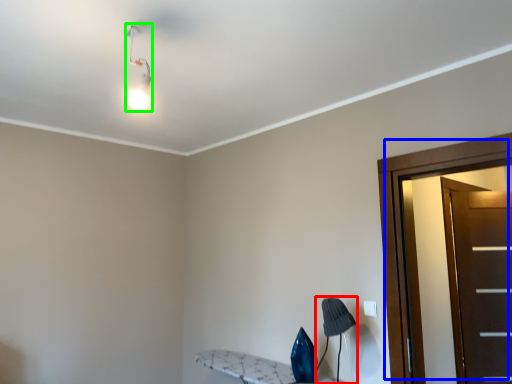
Question: Considering the real-world distances, which object is closest to table lamp (highlighted by a red box)? door (highlighted by a blue box) or light fixture (highlighted by a green box).

Choices:
 (A) door
 (B) light fixture

Answer: (A)